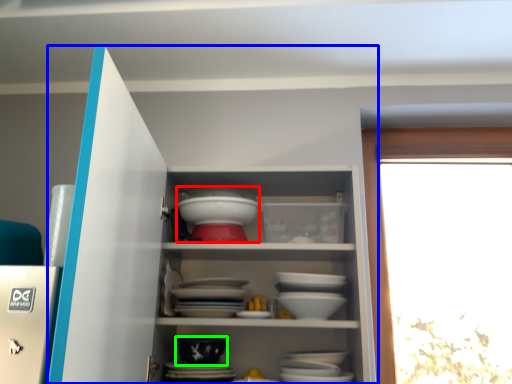
Question: Based on their relative distances, which object is nearer to tableware (highlighted by a red box)? Choose from cupboard (highlighted by a blue box) and bowl (highlighted by a green box).

Choices:
 (A) cupboard
 (B) bowl

Answer: (A)